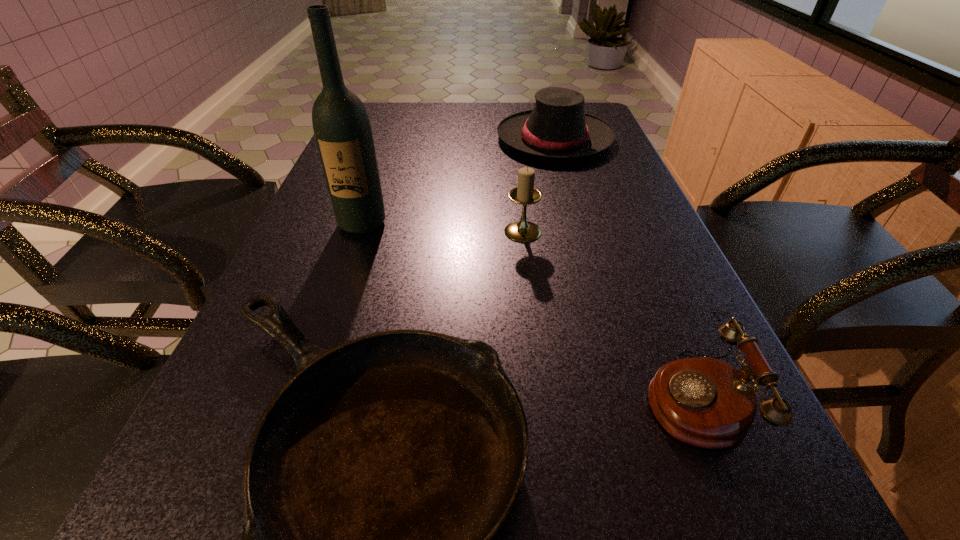
The width and height of the screenshot is (960, 540). Find the location of `wine bottle`. wine bottle is located at coordinates (341, 125).

Identify the location of candle holder. (525, 194).

I want to click on the farthest object, so click(557, 127).

Image resolution: width=960 pixels, height=540 pixels. Find the location of `telephone`. telephone is located at coordinates (702, 401).

You are a GUI agent. You are given a task and a screenshot of the screen. Output one action in this format:
    pyautogui.click(x=<x>, y=<y>)
    Task: Click on the vacant space positioned 0.270m on the labeled side of the wine bottle
    Image resolution: width=960 pixels, height=540 pixels.
    Given the screenshot: What is the action you would take?
    pyautogui.click(x=324, y=337)

I want to click on vacant area located on the right of the second tallest object, so click(x=569, y=232).

Locate an element on the screen. This screenshot has height=540, width=960. free space located on the left of the dress hat is located at coordinates (366, 139).

Where is `free space located 0.160m on the dial of the telephone`? The height and width of the screenshot is (540, 960). free space located 0.160m on the dial of the telephone is located at coordinates (536, 397).

You are a GUI agent. You are given a task and a screenshot of the screen. Output one action in this format:
    pyautogui.click(x=<x>, y=<y>)
    Task: Click on the vacant region located 0.400m on the dial of the telephone
    The width and height of the screenshot is (960, 540).
    Given the screenshot: What is the action you would take?
    pos(371,397)

Where is `free space located on the dial of the telephone`? free space located on the dial of the telephone is located at coordinates (584, 397).